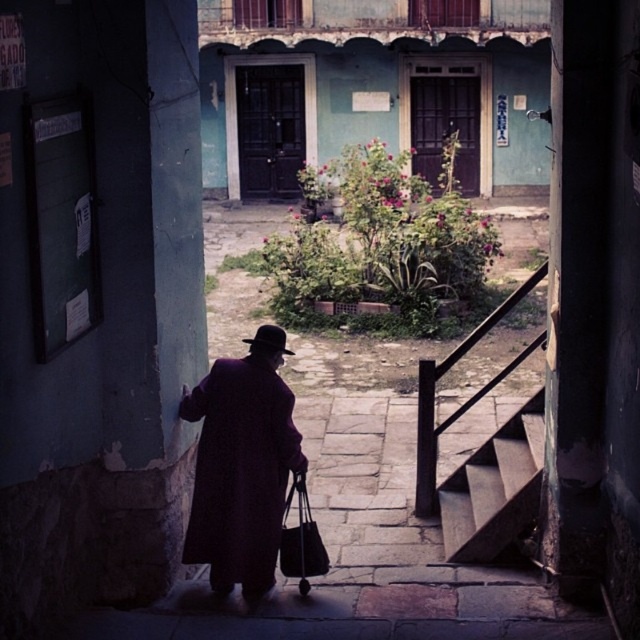
Question: Estimate the real-world distances between objects in this image. Which object is farther from the purple matte coat at center?

Choices:
 (A) wooden stairs at center
 (B) black leather bag at center

Answer: (A)

Question: Can you confirm if purple matte coat at center is positioned above black leather bag at center?

Choices:
 (A) no
 (B) yes

Answer: (B)

Question: Can you confirm if wooden stairs at center is positioned below black leather bag at center?

Choices:
 (A) no
 (B) yes

Answer: (A)

Question: Observing the image, what is the correct spatial positioning of purple matte coat at center in reference to wooden stairs at center?

Choices:
 (A) right
 (B) left

Answer: (B)

Question: Which object is positioned closest to the purple matte coat at center?

Choices:
 (A) wooden stairs at center
 (B) black leather bag at center

Answer: (B)

Question: Which object is positioned closest to the wooden stairs at center?

Choices:
 (A) black leather bag at center
 (B) purple matte coat at center

Answer: (A)